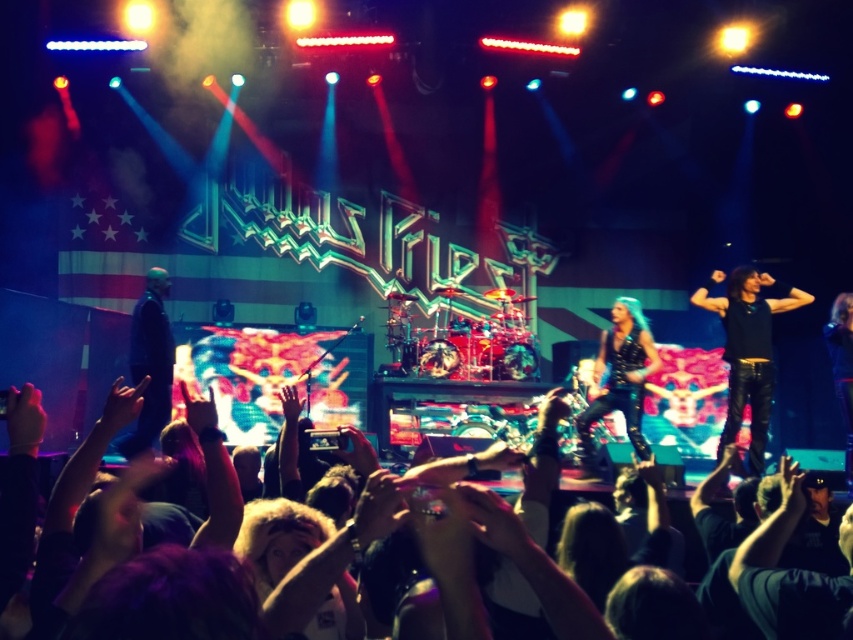
You are a photographer trying to capture the drummer in the concert image. The drummer is located at the point with coordinates 0.548 in the x direction and 0.878 in the y direction. The stage has a dynamic lighting setup with red, blue, and white beams. To ensure proper exposure, you need to know what is at that point. What object is located at the coordinates (747, 349)?

The point at coordinates (747, 349) is on the black leather pants at right.

You are a photographer at the concert and want to capture a closeup shot of both the black leather pants at right and the black leather jacket at left. Since your camera can only focus on one object at a time, which object should you choose to ensure it fills the frame more effectively?

The black leather pants at right has a larger width than the black leather jacket at left, so choosing the black leather pants at right will fill the frame more effectively.

You are a photographer at the concert. You want to capture a photo of the black leather pants at right and the black leather jacket at left. Which object is closer to the camera?

The black leather pants at right are closer to the camera because the black leather jacket at left is behind them.